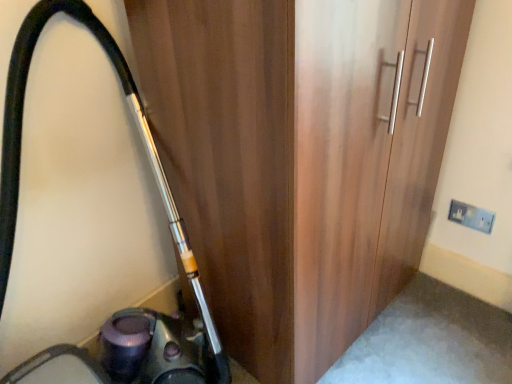
Question: Is white plastic electric outlet at upper right facing away from wooden wardrobe at center?

Choices:
 (A) no
 (B) yes

Answer: (A)

Question: Is white plastic electric outlet at upper right oriented towards wooden wardrobe at center?

Choices:
 (A) no
 (B) yes

Answer: (A)

Question: Does white plastic electric outlet at upper right appear on the right side of wooden wardrobe at center?

Choices:
 (A) yes
 (B) no

Answer: (A)

Question: From the image's perspective, is white plastic electric outlet at upper right on wooden wardrobe at center?

Choices:
 (A) yes
 (B) no

Answer: (B)

Question: Is white plastic electric outlet at upper right thinner than wooden wardrobe at center?

Choices:
 (A) yes
 (B) no

Answer: (A)

Question: From the image's perspective, relative to metallic vacuum cleaner at left, is wooden wardrobe at center above or below?

Choices:
 (A) below
 (B) above

Answer: (B)

Question: Is wooden wardrobe at center wider or thinner than metallic vacuum cleaner at left?

Choices:
 (A) wide
 (B) thin

Answer: (B)

Question: Considering the positions of wooden wardrobe at center and metallic vacuum cleaner at left in the image, is wooden wardrobe at center bigger or smaller than metallic vacuum cleaner at left?

Choices:
 (A) big
 (B) small

Answer: (A)

Question: Considering the positions of wooden wardrobe at center and metallic vacuum cleaner at left in the image, is wooden wardrobe at center taller or shorter than metallic vacuum cleaner at left?

Choices:
 (A) tall
 (B) short

Answer: (B)

Question: From the image's perspective, is wooden wardrobe at center positioned above or below white plastic electric outlet at upper right?

Choices:
 (A) above
 (B) below

Answer: (A)

Question: Based on their sizes in the image, would you say wooden wardrobe at center is bigger or smaller than white plastic electric outlet at upper right?

Choices:
 (A) small
 (B) big

Answer: (B)

Question: Is wooden wardrobe at center inside or outside of white plastic electric outlet at upper right?

Choices:
 (A) outside
 (B) inside

Answer: (A)

Question: Is point (240, 284) closer or farther from the camera than point (455, 203)?

Choices:
 (A) farther
 (B) closer

Answer: (B)

Question: From the image's perspective, is metallic vacuum cleaner at left above or below wooden wardrobe at center?

Choices:
 (A) above
 (B) below

Answer: (B)

Question: Based on their sizes in the image, would you say metallic vacuum cleaner at left is bigger or smaller than wooden wardrobe at center?

Choices:
 (A) big
 (B) small

Answer: (B)